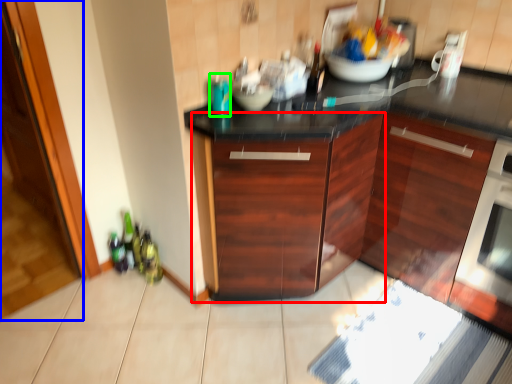
Question: Considering the real-world distances, which object is farthest from cabinetry (highlighted by a red box)? glass door (highlighted by a blue box) or bottle (highlighted by a green box)?

Choices:
 (A) glass door
 (B) bottle

Answer: (A)